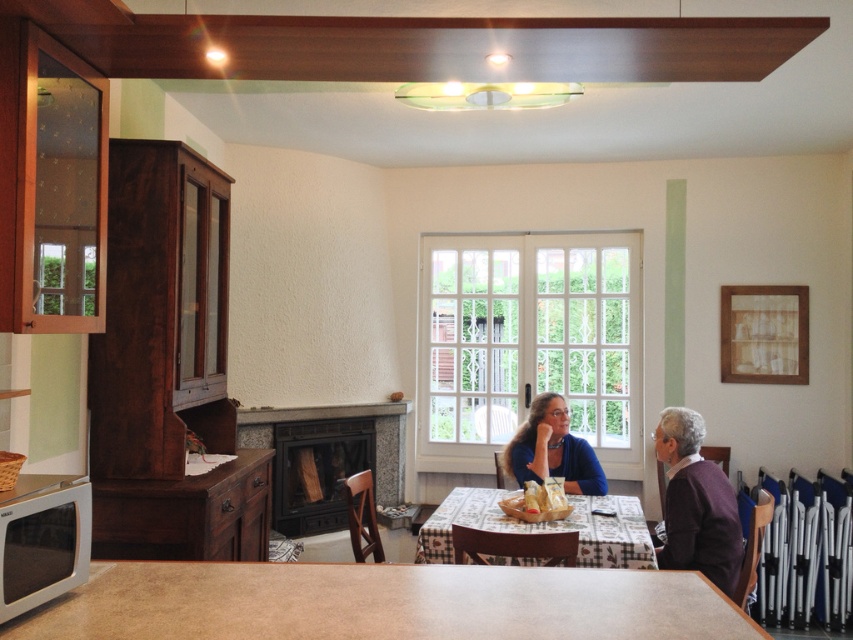
Is silver metallic microwave at lower left below matte blue sweater at center?

Actually, silver metallic microwave at lower left is above matte blue sweater at center.

Is point (90, 520) in front of point (563, 468)?

Yes.

This screenshot has height=640, width=853. What are the coordinates of `silver metallic microwave at lower left` in the screenshot? It's located at [x=42, y=540].

Identify the location of silver metallic microwave at lower left. The width and height of the screenshot is (853, 640). (42, 540).

Identify the location of smooth beige table at center. The width and height of the screenshot is (853, 640). (383, 604).

Between smooth beige table at center and matte blue sweater at center, which one appears on the right side from the viewer's perspective?

matte blue sweater at center

Identify the location of smooth beige table at center. coord(383,604).

Does point (16, 515) come in front of point (693, 417)?

Yes, point (16, 515) is closer to viewer.

You are a GUI agent. You are given a task and a screenshot of the screen. Output one action in this format:
    pyautogui.click(x=<x>, y=<y>)
    Task: Click on the silver metallic microwave at lower left
    The height and width of the screenshot is (640, 853).
    Given the screenshot: What is the action you would take?
    pyautogui.click(x=42, y=540)